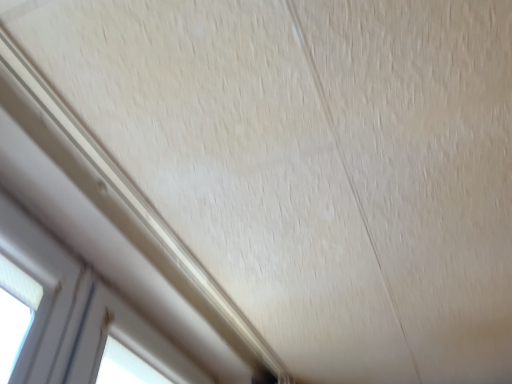
Question: Visually, is white plastic window at lower left, the 1th window in the back-to-front sequence, positioned to the left or to the right of white plastic window at lower left, acting as the second window starting from the bottom?

Choices:
 (A) left
 (B) right

Answer: (B)

Question: Is white plastic window at lower left, the first window positioned from the bottom, taller or shorter than white plastic window at lower left, the second window positioned from the back?

Choices:
 (A) short
 (B) tall

Answer: (B)

Question: From the image's perspective, is white plastic window at lower left, the first window positioned from the bottom, positioned above or below white plastic window at lower left, which is the 2th window in right-to-left order?

Choices:
 (A) above
 (B) below

Answer: (B)

Question: Is point (34, 258) positioned closer to the camera than point (84, 375)?

Choices:
 (A) farther
 (B) closer

Answer: (B)

Question: From the image's perspective, is white plastic window at lower left, the second window positioned from the back, positioned above or below white plastic window at lower left, the first window positioned from the bottom?

Choices:
 (A) below
 (B) above

Answer: (B)

Question: Considering their positions, is white plastic window at lower left, which ranks as the 1th window in front-to-back order, located in front of or behind white plastic window at lower left, arranged as the second window when viewed from the front?

Choices:
 (A) behind
 (B) front

Answer: (B)

Question: Would you say white plastic window at lower left, positioned as the 1th window in left-to-right order, is to the left or to the right of white plastic window at lower left, marked as the second window in a left-to-right arrangement, in the picture?

Choices:
 (A) right
 (B) left

Answer: (B)